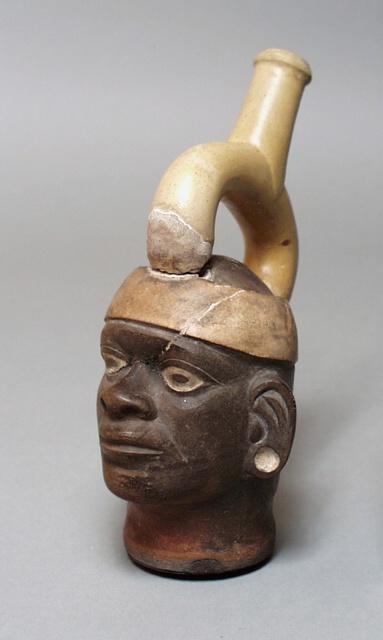
Which is in front, point (268, 164) or point (219, 424)?

Positioned in front is point (219, 424).

Is matte brown ceramic head at center to the left of brown matte/earthenware face at center from the viewer's perspective?

Incorrect, matte brown ceramic head at center is not on the left side of brown matte/earthenware face at center.

Is point (258, 364) positioned in front of point (232, 365)?

No, it is not.

Identify the location of matte brown ceramic head at center. (207, 348).